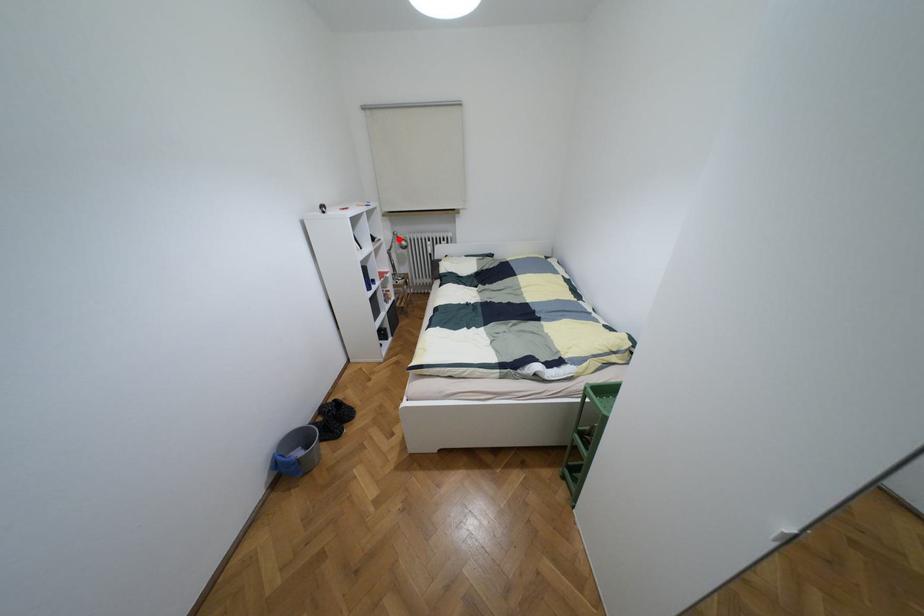
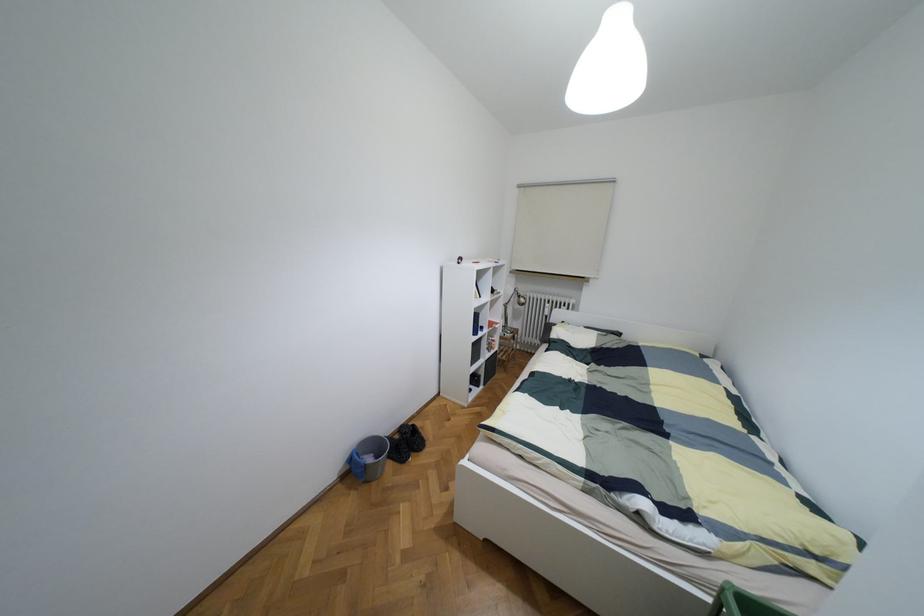
Question: I am providing you with two images of the same scene from different viewpoints. A red point is marked on the first image. Is the red point's position out of view in image 2?

Choices:
 (A) Yes
 (B) No

Answer: (B)